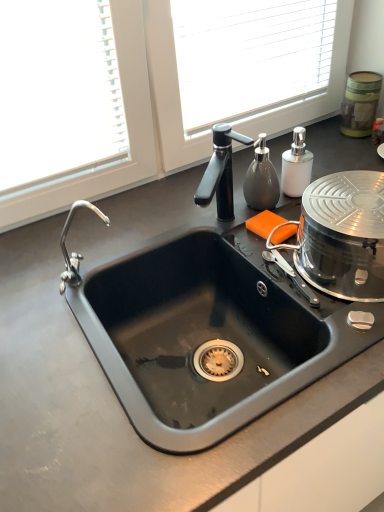
Question: Considering the relative sizes of white matte soap dispenser at upper right and black matte sink at center in the image provided, is white matte soap dispenser at upper right taller than black matte sink at center?

Choices:
 (A) yes
 (B) no

Answer: (B)

Question: Is the position of white matte soap dispenser at upper right more distant than that of black matte sink at center?

Choices:
 (A) yes
 (B) no

Answer: (A)

Question: Does white matte soap dispenser at upper right contain black matte sink at center?

Choices:
 (A) no
 (B) yes

Answer: (A)

Question: From the image's perspective, is white matte soap dispenser at upper right located beneath black matte sink at center?

Choices:
 (A) no
 (B) yes

Answer: (A)

Question: Is white matte soap dispenser at upper right not close to black matte sink at center?

Choices:
 (A) yes
 (B) no

Answer: (B)

Question: Can you confirm if white matte soap dispenser at upper right is shorter than black matte sink at center?

Choices:
 (A) no
 (B) yes

Answer: (B)

Question: Does green textured canister at upper right, acting as the 2th appliance starting from the bottom, have a larger size compared to black matte sink at center?

Choices:
 (A) no
 (B) yes

Answer: (A)

Question: Is green textured canister at upper right, which is the first appliance in top-to-bottom order, thinner than black matte sink at center?

Choices:
 (A) no
 (B) yes

Answer: (B)

Question: From the image's perspective, is green textured canister at upper right, the first appliance in the back-to-front sequence, over black matte sink at center?

Choices:
 (A) no
 (B) yes

Answer: (B)

Question: Does green textured canister at upper right, the first appliance in the back-to-front sequence, have a greater height compared to black matte sink at center?

Choices:
 (A) no
 (B) yes

Answer: (A)

Question: Considering the relative positions of green textured canister at upper right, which is the first appliance in top-to-bottom order, and black matte sink at center in the image provided, is green textured canister at upper right, which is the first appliance in top-to-bottom order, to the right of black matte sink at center from the viewer's perspective?

Choices:
 (A) yes
 (B) no

Answer: (A)

Question: Does green textured canister at upper right, which is the first appliance in top-to-bottom order, come in front of black matte sink at center?

Choices:
 (A) yes
 (B) no

Answer: (B)

Question: Does black matte sink at center have a greater height compared to white matte soap dispenser at upper right?

Choices:
 (A) no
 (B) yes

Answer: (B)